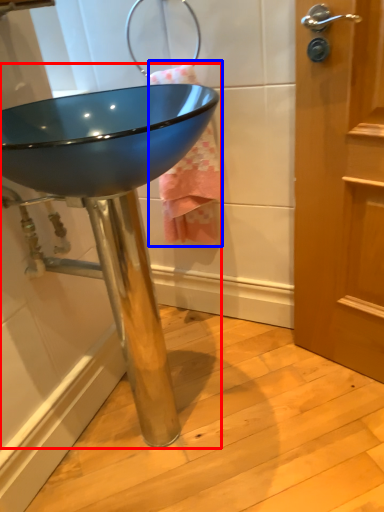
Question: Among these objects, which one is nearest to the camera, sink (highlighted by a red box) or bath towel (highlighted by a blue box)?

Choices:
 (A) sink
 (B) bath towel

Answer: (A)